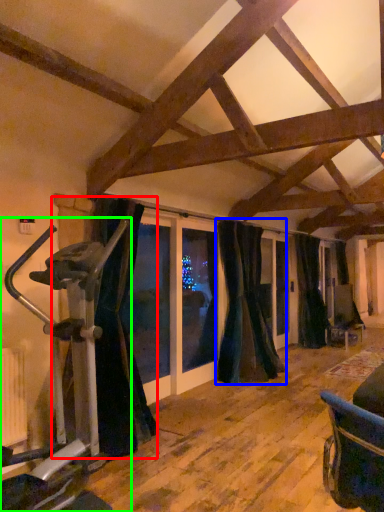
Question: Based on their relative distances, which object is farther from curtain (highlighted by a red box)? Choose from curtain (highlighted by a blue box) and stationary bicycle (highlighted by a green box).

Choices:
 (A) curtain
 (B) stationary bicycle

Answer: (A)